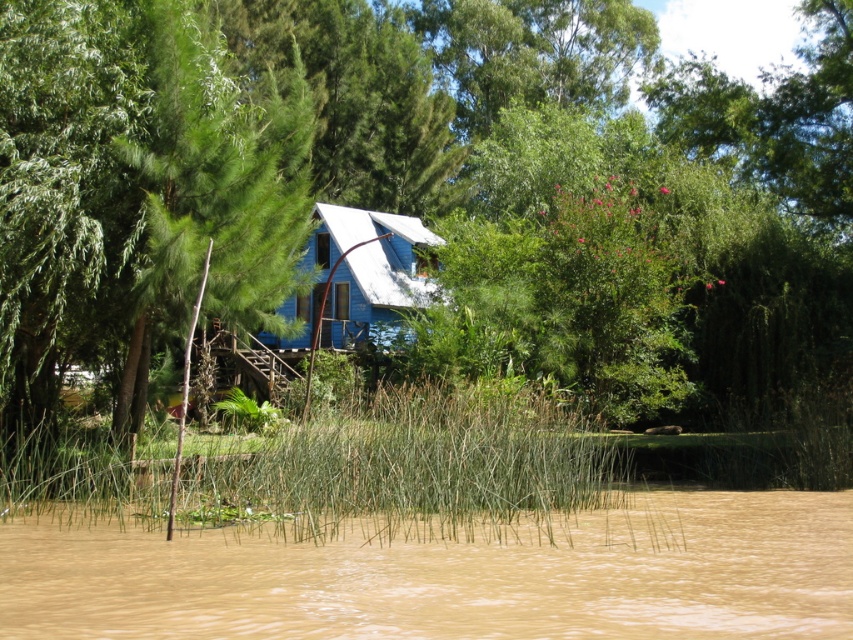
You are standing on the riverside and notice a green leafy tree at center and a green grassy reed at center. Which one is taller?

The green leafy tree at center is taller than the green grassy reed at center.

You are standing on the riverside path and see the green leafy tree at center and the green grassy reed at center. Which object is higher in the scene?

The green leafy tree at center is higher than the green grassy reed at center.

You are standing on the riverside path and notice a green leafy tree at center and brown muddy water at lower center. Which object is located to the right of the other?

The green leafy tree at center is positioned on the right side of brown muddy water at lower center.